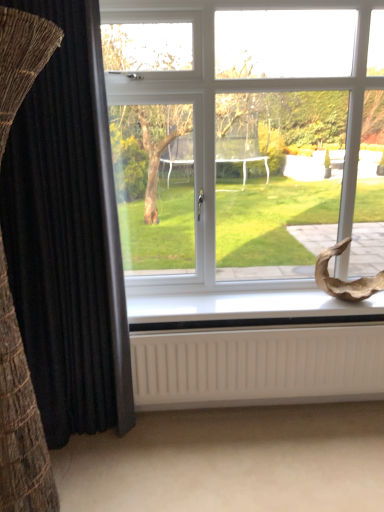
Question: Is white matte radiator at bottom touching white plastic window at center?

Choices:
 (A) no
 (B) yes

Answer: (A)

Question: From a real-world perspective, does white matte radiator at bottom stand above white plastic window at center?

Choices:
 (A) no
 (B) yes

Answer: (A)

Question: Is white matte radiator at bottom not close to white plastic window at center?

Choices:
 (A) yes
 (B) no

Answer: (B)

Question: From a real-world perspective, is white matte radiator at bottom beneath white plastic window at center?

Choices:
 (A) yes
 (B) no

Answer: (A)

Question: From the image's perspective, does white matte radiator at bottom appear higher than white plastic window at center?

Choices:
 (A) yes
 (B) no

Answer: (B)

Question: From the image's perspective, does white matte radiator at bottom appear lower than white plastic window at center?

Choices:
 (A) no
 (B) yes

Answer: (B)

Question: Is white matte radiator at bottom wider than white plastic window sill at lower center?

Choices:
 (A) yes
 (B) no

Answer: (B)

Question: Does white matte radiator at bottom touch white plastic window sill at lower center?

Choices:
 (A) no
 (B) yes

Answer: (A)

Question: From the image's perspective, does white matte radiator at bottom appear lower than white plastic window sill at lower center?

Choices:
 (A) yes
 (B) no

Answer: (A)

Question: Is white matte radiator at bottom facing away from white plastic window sill at lower center?

Choices:
 (A) yes
 (B) no

Answer: (B)

Question: Can you confirm if white matte radiator at bottom is positioned to the left of white plastic window sill at lower center?

Choices:
 (A) yes
 (B) no

Answer: (A)

Question: Is the position of white matte radiator at bottom less distant than that of white plastic window sill at lower center?

Choices:
 (A) yes
 (B) no

Answer: (A)

Question: Can you confirm if white plastic window sill at lower center is taller than white matte radiator at bottom?

Choices:
 (A) yes
 (B) no

Answer: (B)